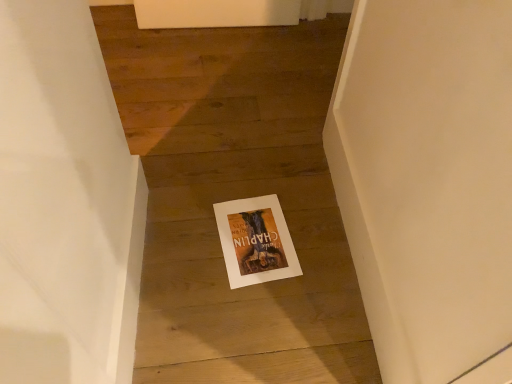
Describe the element at coordinates (255, 241) in the screenshot. The image size is (512, 384). I see `white paper at center` at that location.

This screenshot has width=512, height=384. What are the coordinates of `white paper at center` in the screenshot? It's located at (255, 241).

Measure the distance between white paper at center and camera.

A distance of 1.18 meters exists between white paper at center and camera.

You are a GUI agent. You are given a task and a screenshot of the screen. Output one action in this format:
    pyautogui.click(x=<x>, y=<y>)
    Task: Click on the white paper at center
    Image resolution: width=512 pixels, height=384 pixels.
    Given the screenshot: What is the action you would take?
    pyautogui.click(x=255, y=241)